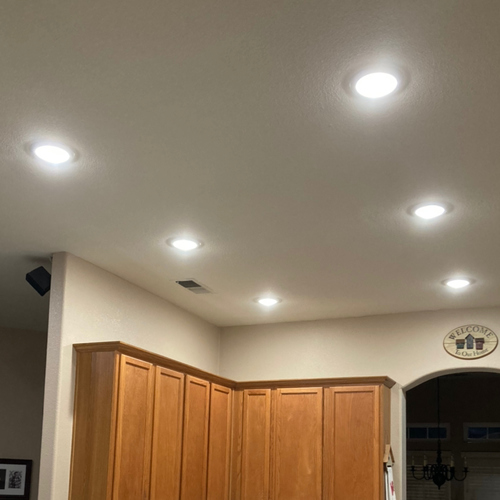
This screenshot has height=500, width=500. Identify the location of vent. (197, 287).